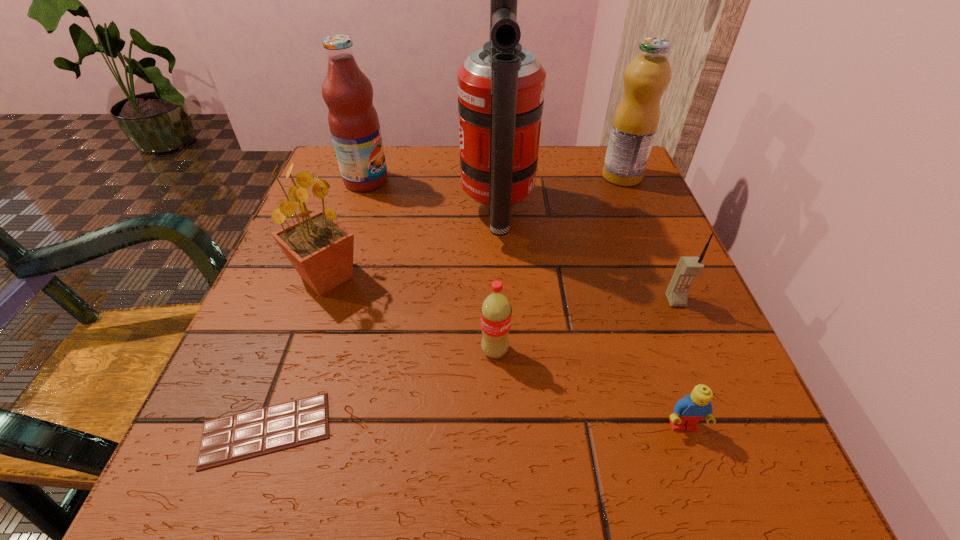
Locate an element on the screen. The width and height of the screenshot is (960, 540). fire extinguisher is located at coordinates (501, 85).

In order to click on the left fruit juice in this screenshot , I will do `click(348, 93)`.

Image resolution: width=960 pixels, height=540 pixels. Find the location of `the right fruit juice`. the right fruit juice is located at coordinates (635, 123).

Find the location of a particular element. The height and width of the screenshot is (540, 960). the fifth shortest object is located at coordinates (320, 248).

Locate an element on the screen. The height and width of the screenshot is (540, 960). cellular telephone is located at coordinates (687, 268).

Identify the location of the sixth farthest object. This screenshot has height=540, width=960. (496, 311).

I want to click on the second shortest object, so click(x=688, y=411).

Where is `the shortest object`? The height and width of the screenshot is (540, 960). the shortest object is located at coordinates (248, 434).

This screenshot has width=960, height=540. I want to click on vacant space located on the front label side of the fire extinguisher, so click(437, 213).

The image size is (960, 540). Identify the location of vacant space located 0.190m on the front label side of the fire extinguisher. pos(370,213).